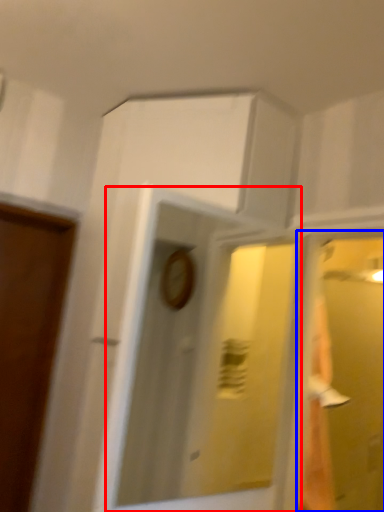
Question: Which of the following is the closest to the observer, mirror (highlighted by a red box) or glass door (highlighted by a blue box)?

Choices:
 (A) mirror
 (B) glass door

Answer: (A)